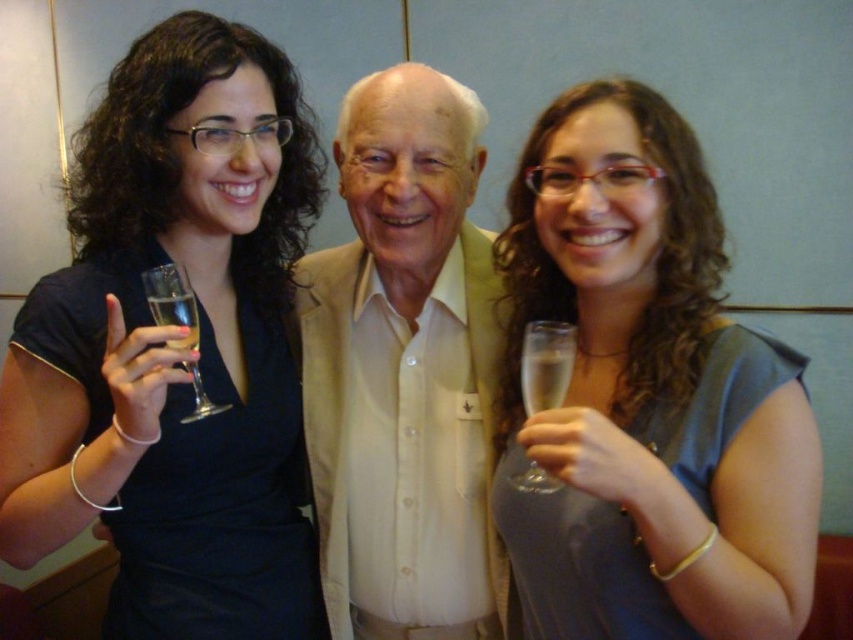
Consider the image. You are standing at the point with coordinates point (126, 330) and want to walk to the point with coordinates point (532, 336). Will you have to walk forward or backward to reach your destination?

Since point (126, 330) is behind point (532, 336), you will have to walk forward to reach the destination.

In the scene shown: You are a photographer at an event and need to adjust the lighting to ensure both the matte black dress at center and the clear glass wine glass at right are equally visible. Given their size difference, which object might require more strategic lighting to highlight its details?

The matte black dress at center has a larger size compared to the clear glass wine glass at right. Since the dress is larger, it might require more strategic lighting to ensure its details are as visible as the smaller wine glass.